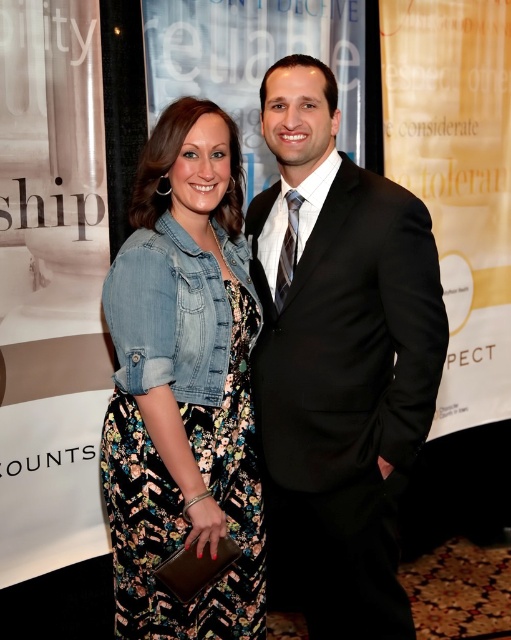
Question: Among these objects, which one is nearest to the camera?

Choices:
 (A) black satin suit at center
 (B) denim jacket at center

Answer: (B)

Question: Which of the following is the closest to the observer?

Choices:
 (A) (446, 348)
 (B) (141, 172)

Answer: (A)

Question: Can you confirm if black satin suit at center is positioned to the left of denim jacket at center?

Choices:
 (A) yes
 (B) no

Answer: (B)

Question: Is black satin suit at center in front of denim jacket at center?

Choices:
 (A) no
 (B) yes

Answer: (A)

Question: Is black satin suit at center positioned at the back of denim jacket at center?

Choices:
 (A) no
 (B) yes

Answer: (B)